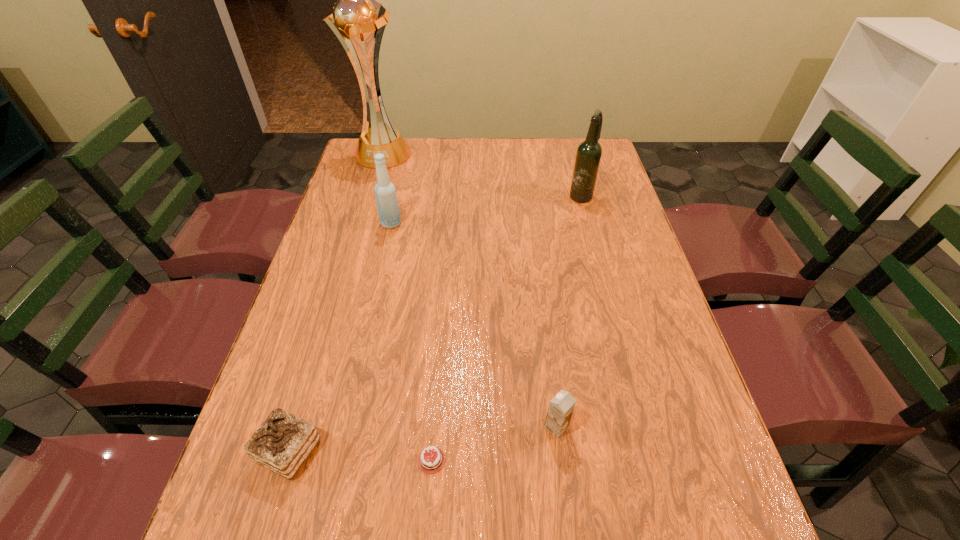
In order to click on bottle that is positioned at the left edge in this screenshot , I will do (x=388, y=209).

What are the coordinates of `chocolate cake at the left edge` in the screenshot? It's located at (282, 443).

Locate an element on the screen. Image resolution: width=960 pixels, height=540 pixels. object positioned at the right edge is located at coordinates (588, 156).

Find the location of a particular element. This screenshot has width=960, height=540. object present at the far left corner is located at coordinates (357, 15).

You are a GUI agent. You are given a task and a screenshot of the screen. Output one action in this format:
    pyautogui.click(x=<x>, y=<y>)
    Task: Click on the vacant area at the far edge of the desktop
    
    Given the screenshot: What is the action you would take?
    pyautogui.click(x=451, y=168)

In the image, there is a desktop. Where is `vacant region at the left edge`? vacant region at the left edge is located at coordinates (367, 267).

In the image, there is a desktop. In order to click on free space at the right edge in this screenshot , I will do `click(637, 339)`.

I want to click on vacant space at the far right corner of the desktop, so click(x=601, y=172).

Find the location of `free area in between the taller chocolate cake and the fourth object from left to right`. free area in between the taller chocolate cake and the fourth object from left to right is located at coordinates (x=360, y=456).

Where is `vacant space that is in between the rightmost object and the farthest object`? This screenshot has width=960, height=540. vacant space that is in between the rightmost object and the farthest object is located at coordinates (481, 174).